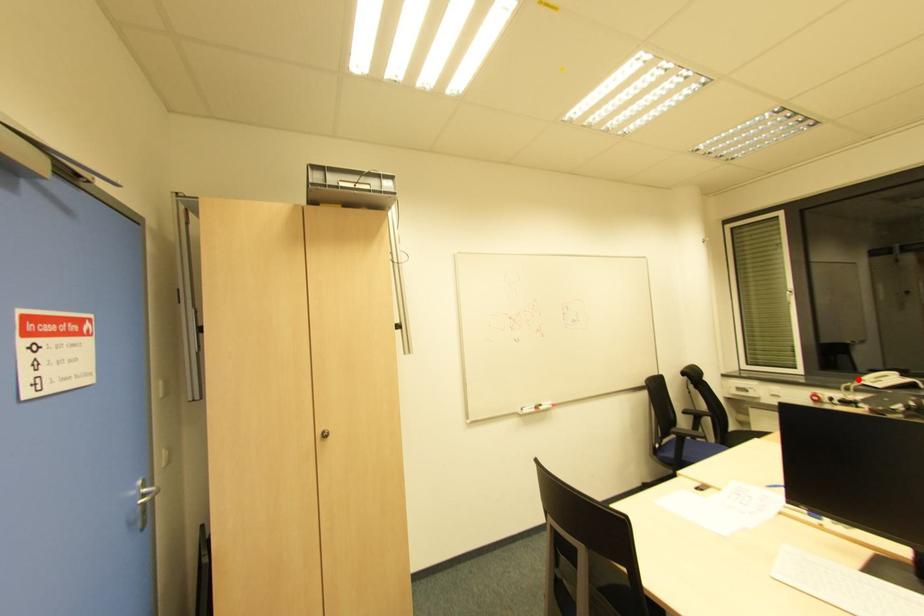
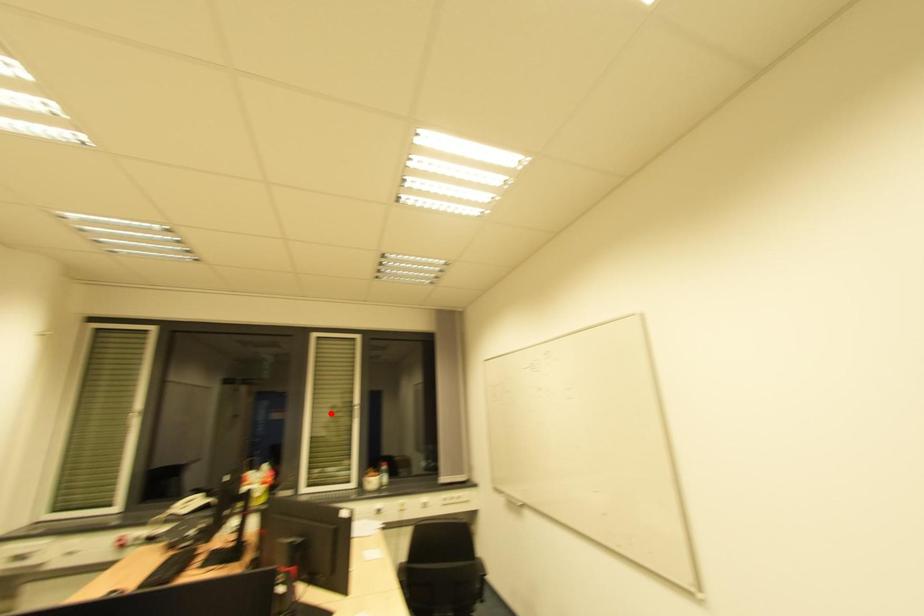
I am providing you with two images of the same scene from different viewpoints. A red point is marked on the first image and another point is marked on the second image. Do the highlighted points in image1 and image2 indicate the same real-world spot?

No